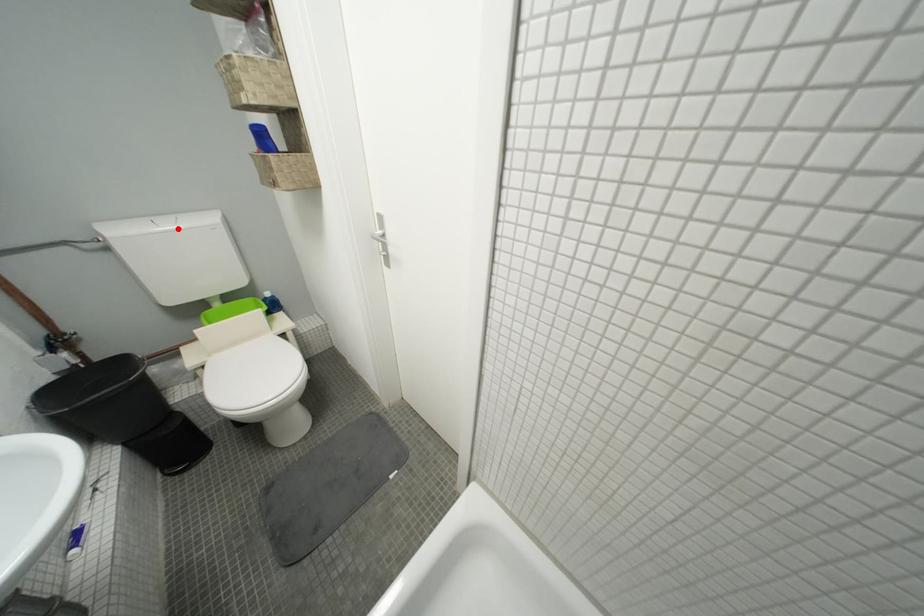
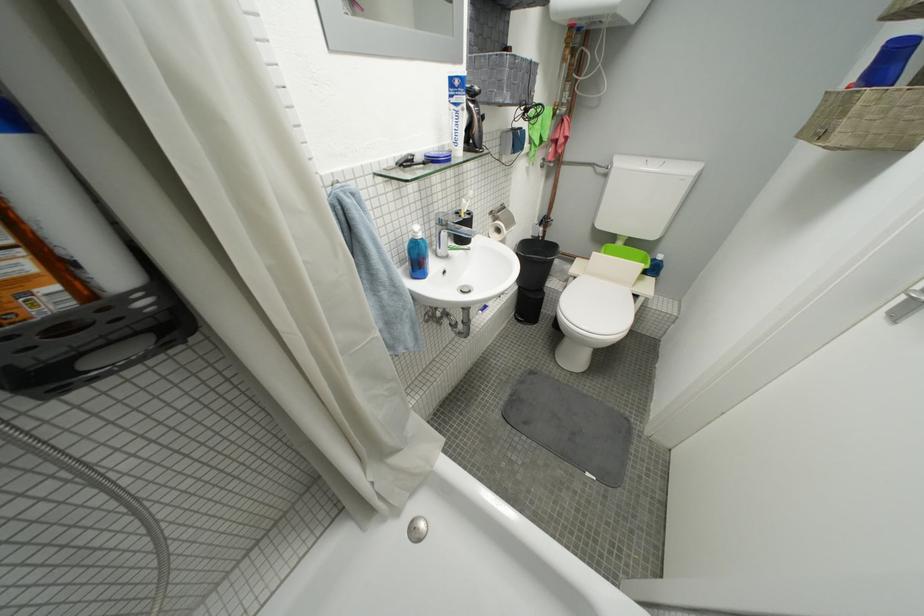
Question: I am providing you with two images of the same scene from different viewpoints. A red point is shown in image1. For the corresponding object point in image2, is it positioned nearer or farther from the camera?

Choices:
 (A) Nearer
 (B) Farther

Answer: (A)